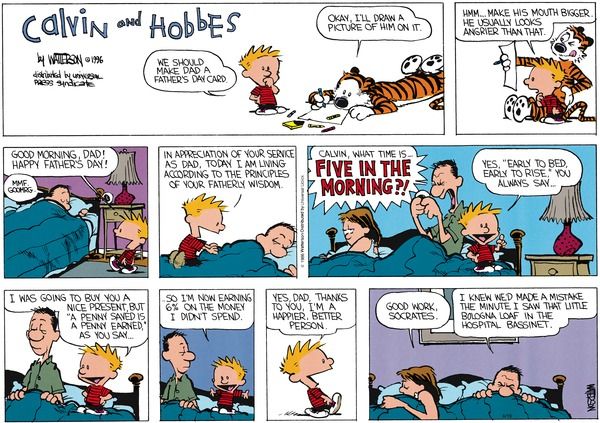
At what (x,y) coordinates should I click in order to perform the action: click on cartoon bed. Please return your answer as a coordinate pair (x, y). Looking at the image, I should click on (33, 236), (233, 260), (408, 263), (31, 411), (174, 412), (485, 408).